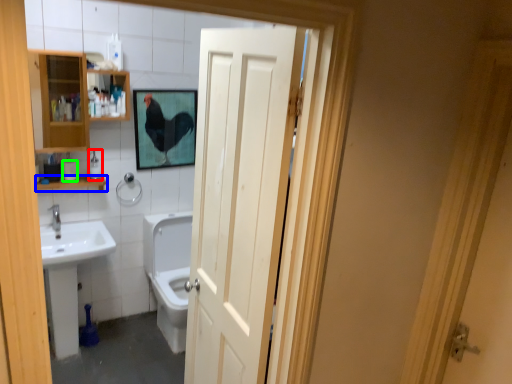
Question: Which object is the closest to the toiletry (highlighted by a red box)? Choose among these: balustrade (highlighted by a blue box) or toilet paper (highlighted by a green box).

Choices:
 (A) balustrade
 (B) toilet paper

Answer: (A)